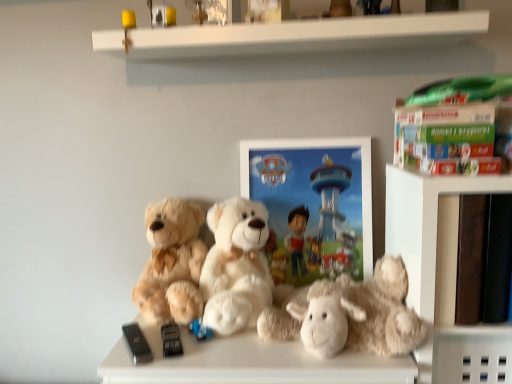
What do you see at coordinates (172, 263) in the screenshot? I see `fuzzy beige teddy bear at left, arranged as the third teddy bear when viewed from the right` at bounding box center [172, 263].

This screenshot has width=512, height=384. What do you see at coordinates (170, 340) in the screenshot?
I see `black plastic remote at center, the 2th toy in the bottom-to-top sequence` at bounding box center [170, 340].

Measure the distance between green cardboard book at upper right and camera.

green cardboard book at upper right is 96.97 centimeters away from camera.

The height and width of the screenshot is (384, 512). What do you see at coordinates (137, 344) in the screenshot?
I see `black matte remote control at lower left, the 1th toy from the bottom` at bounding box center [137, 344].

Locate an element on the screen. This screenshot has width=512, height=384. metallic silver toy at upper center, acting as the first toy starting from the top is located at coordinates (162, 14).

Which object is closer to the camera, metallic silver toy at upper center, acting as the first toy starting from the top, or matte plastic picture frame at center?

metallic silver toy at upper center, acting as the first toy starting from the top, is more forward.

Is metallic silver toy at upper center, acting as the first toy starting from the top, at the left side of matte plastic picture frame at center?

Yes.

Is metallic silver toy at upper center, acting as the first toy starting from the top, next to matte plastic picture frame at center and touching it?

No, metallic silver toy at upper center, acting as the first toy starting from the top, is not in contact with matte plastic picture frame at center.

Considering the relative sizes of matte plastic picture frame at center and black matte remote control at lower left, the 1th toy from the bottom, in the image provided, is matte plastic picture frame at center shorter than black matte remote control at lower left, the 1th toy from the bottom,?

No, matte plastic picture frame at center is not shorter than black matte remote control at lower left, the 1th toy from the bottom.

Is matte plastic picture frame at center turned away from black matte remote control at lower left, the 1th toy from the bottom?

matte plastic picture frame at center is not turned away from black matte remote control at lower left, the 1th toy from the bottom.

What are the coordinates of `picture frame behind the black matte remote control at lower left, the 1th toy from the bottom` in the screenshot? It's located at [313, 205].

In terms of width, does matte plastic picture frame at center look wider or thinner when compared to black matte remote control at lower left, the 3th toy when ordered from top to bottom?

Clearly, matte plastic picture frame at center has less width compared to black matte remote control at lower left, the 3th toy when ordered from top to bottom.

Is white plush teddy bear at center, the 2th teddy bear in the right-to-left sequence, positioned with its back to metallic silver toy at upper center, acting as the first toy starting from the top?

white plush teddy bear at center, the 2th teddy bear in the right-to-left sequence, is not turned away from metallic silver toy at upper center, acting as the first toy starting from the top.

Would you consider white plush teddy bear at center, which appears as the second teddy bear when viewed from the left, to be distant from metallic silver toy at upper center, acting as the first toy starting from the top?

That's not correct — white plush teddy bear at center, which appears as the second teddy bear when viewed from the left, is a little close to metallic silver toy at upper center, acting as the first toy starting from the top.

Which is more to the left, white plush teddy bear at center, the 2th teddy bear in the right-to-left sequence, or metallic silver toy at upper center, acting as the first toy starting from the top?

metallic silver toy at upper center, acting as the first toy starting from the top, is more to the left.

Which is nearer, (269, 287) or (163, 21)?

The point (269, 287) is closer.

Is fuzzy beige teddy bear at left, arranged as the third teddy bear when viewed from the right, touching white plush teddy bear at center, which appears as the second teddy bear when viewed from the left?

No, fuzzy beige teddy bear at left, arranged as the third teddy bear when viewed from the right, is not in contact with white plush teddy bear at center, which appears as the second teddy bear when viewed from the left.

Who is smaller, fuzzy beige teddy bear at left, arranged as the third teddy bear when viewed from the right, or white plush teddy bear at center, which appears as the second teddy bear when viewed from the left?

fuzzy beige teddy bear at left, arranged as the third teddy bear when viewed from the right, is smaller.

Does point (149, 226) come behind point (248, 302)?

Yes, point (149, 226) is farther from viewer.

From a real-world perspective, is fuzzy beige teddy bear at left, the first teddy bear in the left-to-right sequence, physically above white plush teddy bear at center, which appears as the second teddy bear when viewed from the left?

Actually, fuzzy beige teddy bear at left, the first teddy bear in the left-to-right sequence, is physically below white plush teddy bear at center, which appears as the second teddy bear when viewed from the left, in the real world.

Is smooth brown bookshelf at right oriented away from white plush teddy bear at center, the 2th teddy bear in the right-to-left sequence?

No, smooth brown bookshelf at right is not facing the opposite direction of white plush teddy bear at center, the 2th teddy bear in the right-to-left sequence.

In the image, is smooth brown bookshelf at right positioned in front of or behind white plush teddy bear at center, which appears as the second teddy bear when viewed from the left?

Visually, smooth brown bookshelf at right is located in front of white plush teddy bear at center, which appears as the second teddy bear when viewed from the left.

Locate an element on the screen. The height and width of the screenshot is (384, 512). teddy bear that is the 2nd object to the left of the smooth brown bookshelf at right, starting at the anchor is located at coordinates (236, 266).

Based on the photo, from the image's perspective, is fluffy white teddy bear at center, which appears as the first teddy bear when viewed from the right, located above black plastic remote at center, the 2th toy in the bottom-to-top sequence?

Yes, from the image's perspective, fluffy white teddy bear at center, which appears as the first teddy bear when viewed from the right, is on top of black plastic remote at center, the 2th toy in the bottom-to-top sequence.

From a real-world perspective, who is located higher, fluffy white teddy bear at center, acting as the third teddy bear starting from the left, or black plastic remote at center, which is the 2th toy in top-to-bottom order?

From a 3D spatial view, fluffy white teddy bear at center, acting as the third teddy bear starting from the left, is above.

Which of these two, fluffy white teddy bear at center, which appears as the first teddy bear when viewed from the right, or black plastic remote at center, the 2th toy in the bottom-to-top sequence, is bigger?

With larger size is fluffy white teddy bear at center, which appears as the first teddy bear when viewed from the right.

Considering the positions of objects black matte remote control at lower left, the 1th toy from the bottom, and metallic silver toy at upper center, which appears as the third toy when ordered from the bottom, in the image provided, who is more to the right, black matte remote control at lower left, the 1th toy from the bottom, or metallic silver toy at upper center, which appears as the third toy when ordered from the bottom,?

metallic silver toy at upper center, which appears as the third toy when ordered from the bottom, is more to the right.

From the image's perspective, which one is positioned higher, black matte remote control at lower left, the 1th toy from the bottom, or metallic silver toy at upper center, acting as the first toy starting from the top?

metallic silver toy at upper center, acting as the first toy starting from the top.

Is there a large distance between black matte remote control at lower left, the 1th toy from the bottom, and metallic silver toy at upper center, acting as the first toy starting from the top?

No.

Does black matte remote control at lower left, the 3th toy when ordered from top to bottom, have a greater width compared to metallic silver toy at upper center, which appears as the third toy when ordered from the bottom?

Correct, the width of black matte remote control at lower left, the 3th toy when ordered from top to bottom, exceeds that of metallic silver toy at upper center, which appears as the third toy when ordered from the bottom.

Identify the location of toy above the matte plastic picture frame at center (from the image's perspective). (162, 14).

Locate an element on the screen. The width and height of the screenshot is (512, 384). the 1st toy located beneath the matte plastic picture frame at center (from a real-world perspective) is located at coordinates (137, 344).

Estimate the real-world distances between objects in this image. Which object is further from black matte remote control at lower left, the 3th toy when ordered from top to bottom, black plastic remote at center, the 2th toy in the bottom-to-top sequence, or matte plastic picture frame at center?

matte plastic picture frame at center is further to black matte remote control at lower left, the 3th toy when ordered from top to bottom.

Looking at the image, which one is located further to smooth brown bookshelf at right, metallic silver toy at upper center, which appears as the third toy when ordered from the bottom, or black plastic remote at center, the 2th toy in the bottom-to-top sequence?

metallic silver toy at upper center, which appears as the third toy when ordered from the bottom.

Considering their positions, is white plush teddy bear at center, which appears as the second teddy bear when viewed from the left, positioned further to metallic silver toy at upper center, which appears as the third toy when ordered from the bottom, than black plastic remote at center, the 2th toy in the bottom-to-top sequence?

black plastic remote at center, the 2th toy in the bottom-to-top sequence, is further to metallic silver toy at upper center, which appears as the third toy when ordered from the bottom.

Based on their spatial positions, is black plastic remote at center, which is the 2th toy in top-to-bottom order, or fuzzy beige teddy bear at left, the first teddy bear in the left-to-right sequence, further from green cardboard book at upper right?

black plastic remote at center, which is the 2th toy in top-to-bottom order.

Which object lies nearer to the anchor point black matte remote control at lower left, the 3th toy when ordered from top to bottom, fuzzy beige teddy bear at left, the first teddy bear in the left-to-right sequence, or white plush teddy bear at center, which appears as the second teddy bear when viewed from the left?

Among the two, fuzzy beige teddy bear at left, the first teddy bear in the left-to-right sequence, is located nearer to black matte remote control at lower left, the 3th toy when ordered from top to bottom.

Estimate the real-world distances between objects in this image. Which object is closer to black matte remote control at lower left, the 3th toy when ordered from top to bottom, white plush teddy bear at center, which appears as the second teddy bear when viewed from the left, or matte plastic picture frame at center?

white plush teddy bear at center, which appears as the second teddy bear when viewed from the left, is positioned closer to the anchor black matte remote control at lower left, the 3th toy when ordered from top to bottom.

Estimate the real-world distances between objects in this image. Which object is further from fluffy white teddy bear at center, acting as the third teddy bear starting from the left, black matte remote control at lower left, the 1th toy from the bottom, or smooth brown bookshelf at right?

black matte remote control at lower left, the 1th toy from the bottom, lies further to fluffy white teddy bear at center, acting as the third teddy bear starting from the left, than the other object.

From the image, which object appears to be nearer to black matte remote control at lower left, the 1th toy from the bottom, matte plastic picture frame at center or fluffy white teddy bear at center, which appears as the first teddy bear when viewed from the right?

Based on the image, fluffy white teddy bear at center, which appears as the first teddy bear when viewed from the right, appears to be nearer to black matte remote control at lower left, the 1th toy from the bottom.

Where is `teddy bear between black plastic remote at center, the 2th toy in the bottom-to-top sequence, and fluffy white teddy bear at center, which appears as the first teddy bear when viewed from the right`? This screenshot has width=512, height=384. teddy bear between black plastic remote at center, the 2th toy in the bottom-to-top sequence, and fluffy white teddy bear at center, which appears as the first teddy bear when viewed from the right is located at coordinates (236, 266).

Locate an element on the screen. picture frame between metallic silver toy at upper center, acting as the first toy starting from the top, and fuzzy beige teddy bear at left, arranged as the third teddy bear when viewed from the right, in the vertical direction is located at coordinates (313, 205).

Locate an element on the screen. The image size is (512, 384). picture frame between black plastic remote at center, the 2th toy in the bottom-to-top sequence, and smooth brown bookshelf at right is located at coordinates (313, 205).

The image size is (512, 384). What are the coordinates of `picture frame between black matte remote control at lower left, the 3th toy when ordered from top to bottom, and smooth brown bookshelf at right` in the screenshot? It's located at (313, 205).